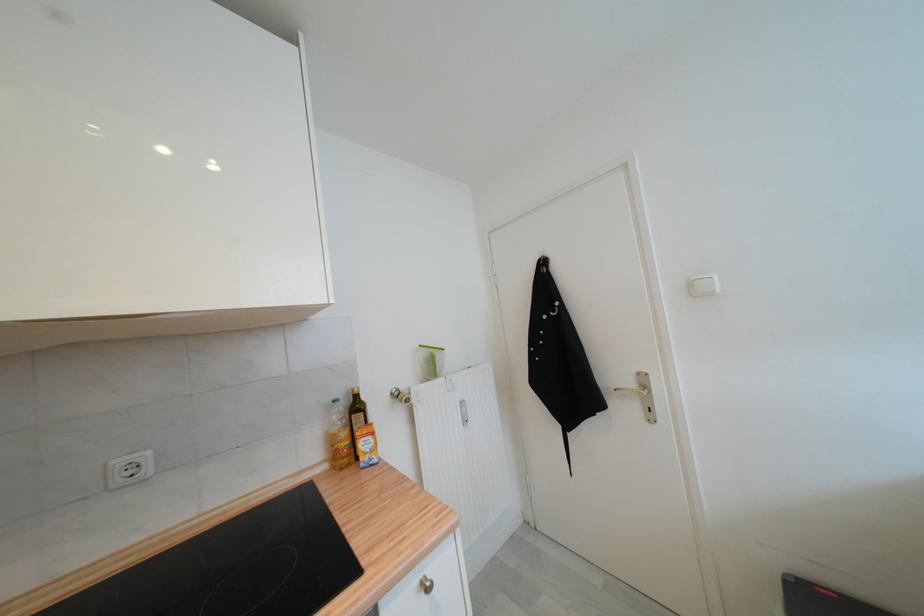
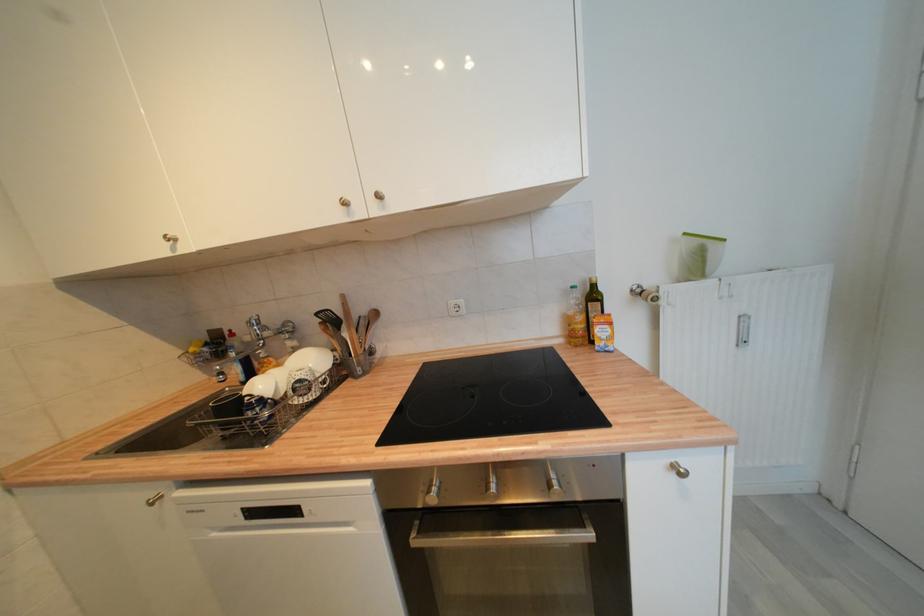
Looking at this image, the images are taken continuously from a first-person perspective. In which direction is your viewpoint rotating?

The camera rotated toward left-down.